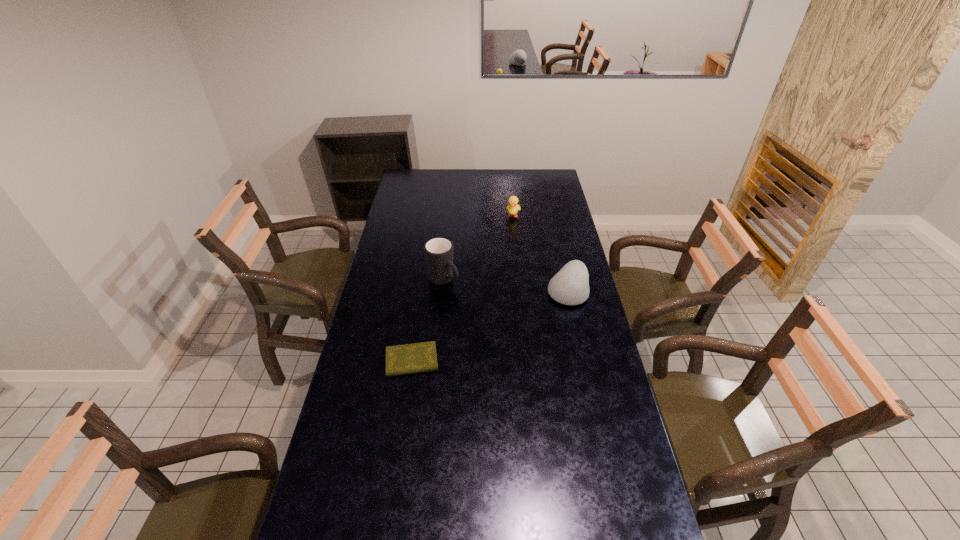
This screenshot has height=540, width=960. I want to click on vacant space located on the front-facing side of the duckling, so click(507, 248).

At what (x,y) coordinates should I click in order to perform the action: click on free space located on the side of the tallest object with the handle. Please return your answer as a coordinate pair (x, y). The width and height of the screenshot is (960, 540). Looking at the image, I should click on (467, 299).

This screenshot has height=540, width=960. Identify the location of vacant point located 0.280m on the side of the tallest object with the handle. (501, 326).

I want to click on vacant space situated 0.070m on the side of the tallest object with the handle, so click(x=465, y=298).

Where is `object that is at the left edge`? Image resolution: width=960 pixels, height=540 pixels. object that is at the left edge is located at coordinates (405, 359).

Identify the location of object present at the right edge. (570, 286).

The width and height of the screenshot is (960, 540). I want to click on vacant area at the far edge, so click(x=437, y=171).

The image size is (960, 540). In the image, there is a desktop. In order to click on vacant space at the near edge in this screenshot , I will do `click(451, 502)`.

What are the coordinates of `vacant position at the left edge of the desktop` in the screenshot? It's located at coord(419,221).

Locate an element on the screen. vacant region at the right edge of the desktop is located at coordinates (577, 253).